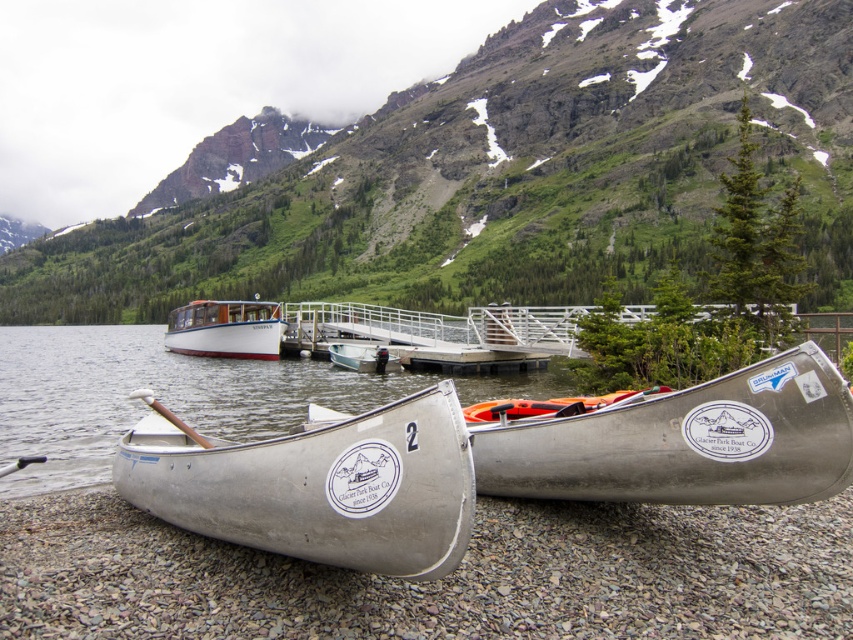
Consider the image. You are standing at the lakeside and want to choose the canoe that is nearer to you. Which one between the silver metallic canoe at lower right and the metallic silver canoe at center should you pick?

The silver metallic canoe at lower right is closer to the viewer than the metallic silver canoe at center, so you should pick the silver metallic canoe at lower right.

You are an observer standing at the lakeside looking towards the mountains. Which object is positioned to the left when comparing the brushed metal mountain at upper center and the silver metallic canoe at lower right?

The brushed metal mountain at upper center is positioned to the left of the silver metallic canoe at lower right.

You are a park ranger who needs to move a 10 meter long safety rope from the silver metallic canoe at lower center to the silver metallic canoe at lower right. Is the rope long enough to reach between them?

The distance between the silver metallic canoe at lower center and the silver metallic canoe at lower right is 9.71 meters. Since the rope is 10 meters long, it is slightly longer than the distance, so the rope is long enough to reach between them.